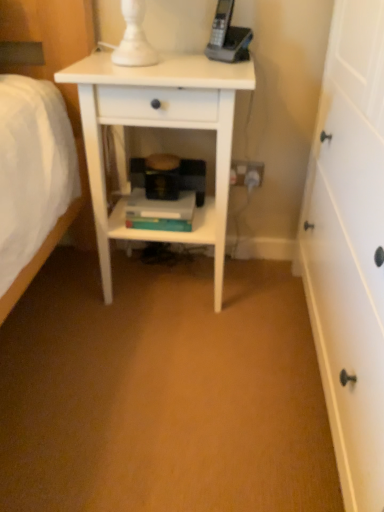
Question: From their relative heights in the image, would you say hardcover books at center is taller or shorter than white plastic electrical outlet at lower center?

Choices:
 (A) tall
 (B) short

Answer: (B)

Question: Looking at their shapes, would you say hardcover books at center is wider or thinner than white plastic electrical outlet at lower center?

Choices:
 (A) thin
 (B) wide

Answer: (B)

Question: Estimate the real-world distances between objects in this image. Which object is farther from the hardcover books at center?

Choices:
 (A) white plastic electrical outlet at lower center
 (B) white matte nightstand at center

Answer: (A)

Question: Based on their relative distances, which object is nearer to the hardcover books at center?

Choices:
 (A) white plastic electrical outlet at lower center
 (B) white matte nightstand at center

Answer: (B)